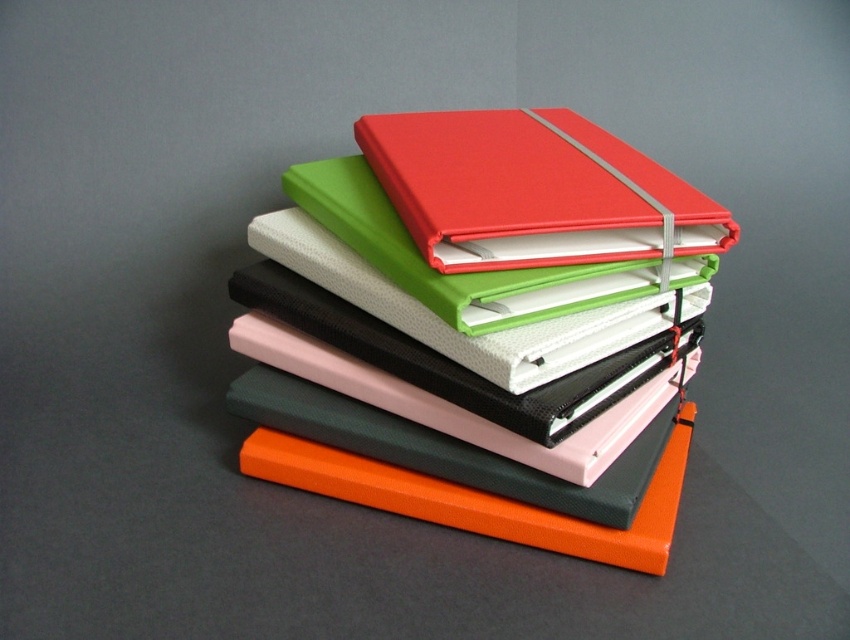
Is point (714, 221) behind point (445, 460)?

That is True.

Is point (656, 225) less distant than point (539, 492)?

No, (656, 225) is further to viewer.

Locate an element on the screen. The height and width of the screenshot is (640, 850). matte red binder at center is located at coordinates (530, 189).

Which is above, matte red binder at upper center or orange matte binder at center?

Positioned higher is matte red binder at upper center.

Does matte red binder at upper center have a smaller size compared to orange matte binder at center?

Actually, matte red binder at upper center might be larger than orange matte binder at center.

The height and width of the screenshot is (640, 850). In order to click on matte red binder at upper center in this screenshot , I will do `click(466, 273)`.

This screenshot has height=640, width=850. Find the location of `matte red binder at upper center`. matte red binder at upper center is located at coordinates (466, 273).

Which is below, matte red binder at center or matte red binder at upper center?

Positioned lower is matte red binder at upper center.

Can you confirm if matte red binder at center is positioned to the right of matte red binder at upper center?

Correct, you'll find matte red binder at center to the right of matte red binder at upper center.

Is point (615, 214) positioned in front of point (612, 291)?

Yes, point (615, 214) is in front of point (612, 291).

Identify the location of matte red binder at center. The height and width of the screenshot is (640, 850). click(x=530, y=189).